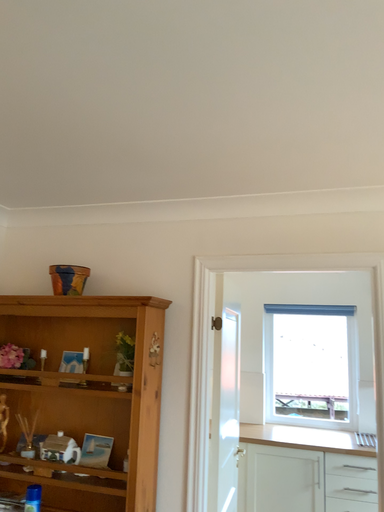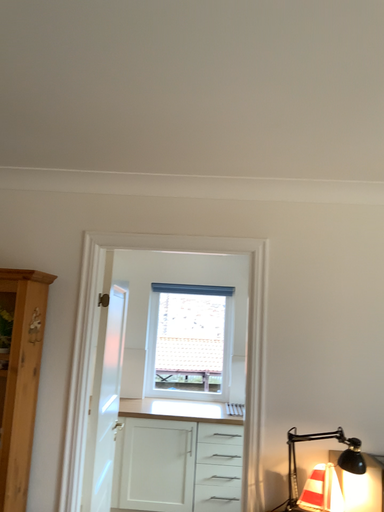
Question: How did the camera likely rotate when shooting the video?

Choices:
 (A) rotated right
 (B) rotated left

Answer: (A)